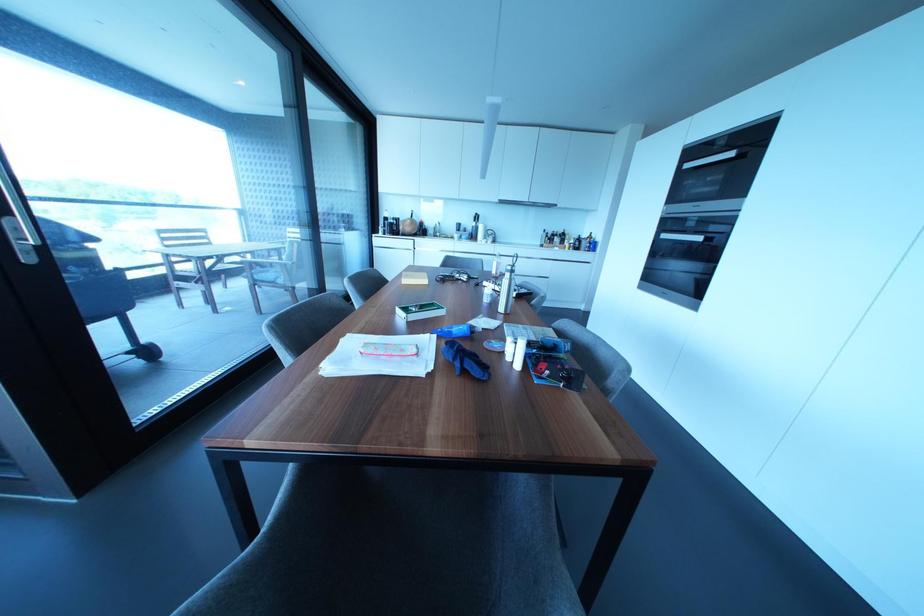
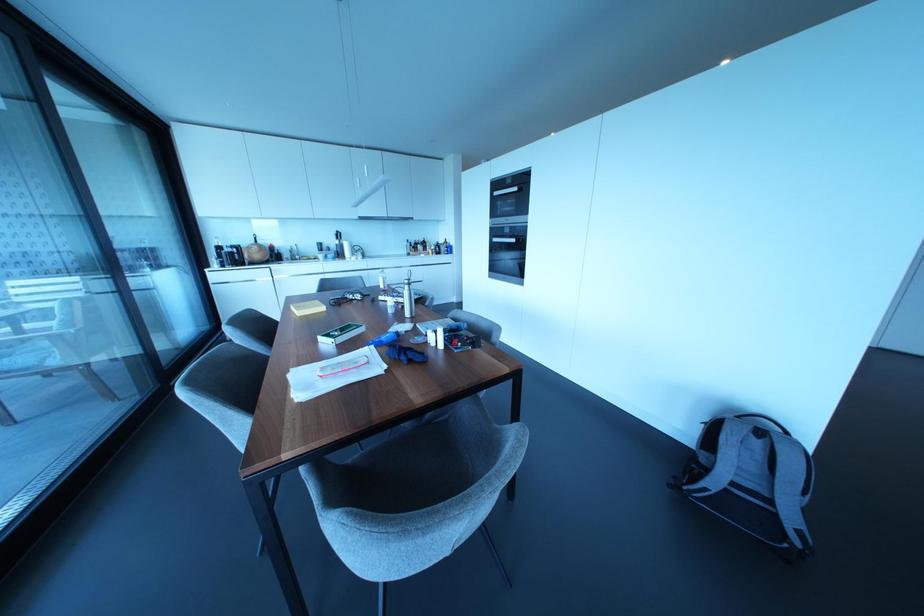
Find the pixel in the second image that matches [506,274] in the first image.

(406, 286)